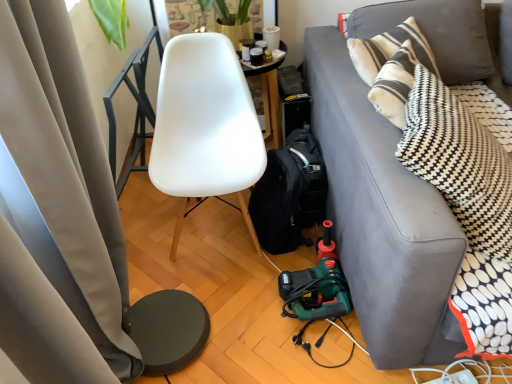
Locate an element on the screen. free space to the left of white matte chair at center is located at coordinates (153, 234).